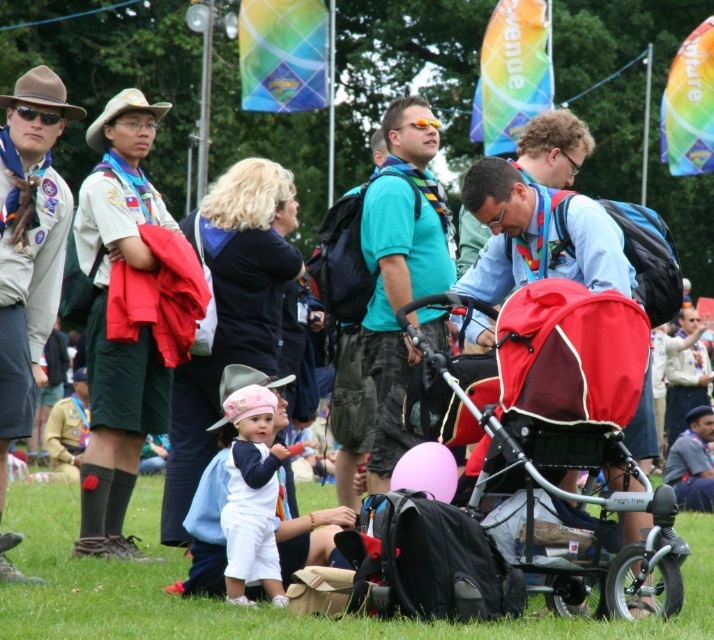
What do you see at coordinates (129, 314) in the screenshot?
I see `khaki uniform at center` at bounding box center [129, 314].

Between point (159, 301) and point (438, 499), which one is positioned in front?

Point (438, 499) is in front.

Identify the location of khaki uniform at center. (129, 314).

From the picture: Can you confirm if khaki uniform at left is positioned to the right of pink fabric baby at center?

In fact, khaki uniform at left is to the left of pink fabric baby at center.

Who is more distant from viewer, (40,161) or (256,545)?

The point (40,161) is more distant.

The image size is (714, 640). Find the location of `khaki uniform at left`. khaki uniform at left is located at coordinates (29, 244).

Is khaki uniform at left smaller than teal fabric shirt at center?

Yes.

Can you confirm if khaki uniform at left is shorter than teal fabric shirt at center?

No.

Which is in front, point (10, 140) or point (381, 324)?

Positioned in front is point (10, 140).

The image size is (714, 640). What are the coordinates of `khaki uniform at left` in the screenshot? It's located at (29, 244).